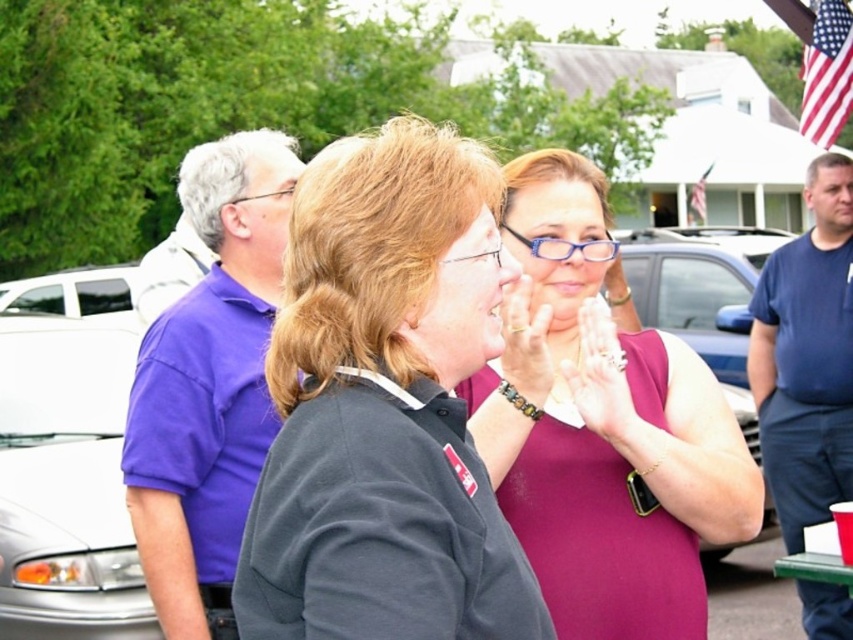
You are a photographer taking a picture of the dark gray shirt at center and the smooth skin hands at center. Which object should you focus on first to ensure both are in focus?

The dark gray shirt at center is closer to the viewer than smooth skin hands at center, so you should focus on the dark gray shirt at center first to ensure both are in focus.

You are a photographer trying to capture a photo of the dark gray shirt at center and the matte gold ring at center. Which object should you focus on first if you want to ensure both are in focus?

The dark gray shirt at center is much taller than the matte gold ring at center, so you should focus on the dark gray shirt at center first to ensure both are in focus.